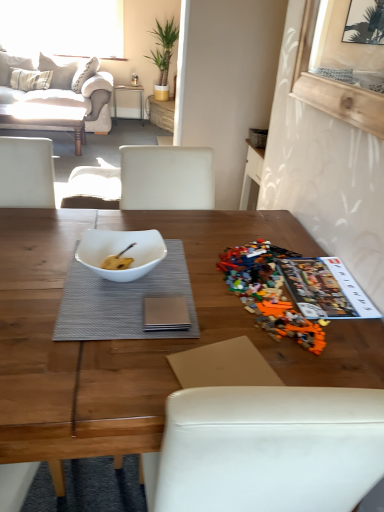
I want to click on free space above gray textured placemat at center (from a real-world perspective), so click(x=123, y=292).